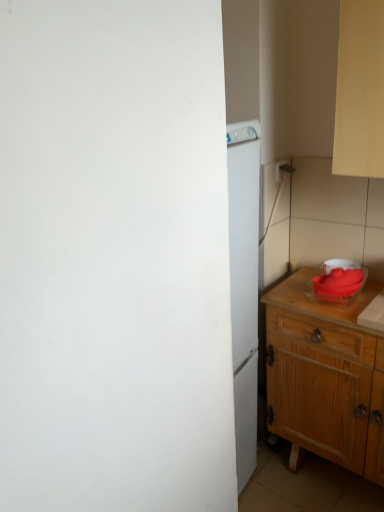
What do you see at coordinates (325, 376) in the screenshot? The width and height of the screenshot is (384, 512). I see `wooden cabinet at right` at bounding box center [325, 376].

Identify the location of matte red bowl at right. The height and width of the screenshot is (512, 384). (335, 283).

The height and width of the screenshot is (512, 384). What do you see at coordinates (335, 283) in the screenshot?
I see `matte red bowl at right` at bounding box center [335, 283].

Find the location of `white plastic electric outlet at upper right`. white plastic electric outlet at upper right is located at coordinates (281, 169).

The height and width of the screenshot is (512, 384). In order to click on wooden cabinet at right in this screenshot , I will do `click(325, 376)`.

Between point (282, 164) and point (296, 342), which one is positioned in front?

Point (296, 342)

In terms of size, does white plastic electric outlet at upper right appear bigger or smaller than wooden cabinet at right?

white plastic electric outlet at upper right is smaller than wooden cabinet at right.

Is white plastic electric outlet at upper right facing away from wooden cabinet at right?

No, white plastic electric outlet at upper right's orientation is not away from wooden cabinet at right.

Which of these two, white plastic electric outlet at upper right or wooden cabinet at right, stands shorter?

Standing shorter between the two is white plastic electric outlet at upper right.

Considering the relative sizes of matte red bowl at right and white plastic electric outlet at upper right in the image provided, is matte red bowl at right shorter than white plastic electric outlet at upper right?

No, matte red bowl at right is not shorter than white plastic electric outlet at upper right.

Can white plastic electric outlet at upper right be found inside matte red bowl at right?

Definitely not — white plastic electric outlet at upper right is not inside matte red bowl at right.

Is matte red bowl at right positioned in front of white plastic electric outlet at upper right?

Yes, it is.

How far apart are matte red bowl at right and white plastic electric outlet at upper right?

matte red bowl at right and white plastic electric outlet at upper right are 19.51 inches apart from each other.

Which is less distant, (370, 356) or (323, 270)?

Point (370, 356)

Can you see wooden cabinet at right touching matte red bowl at right?

wooden cabinet at right and matte red bowl at right are clearly separated.

From the image's perspective, between wooden cabinet at right and matte red bowl at right, who is located below?

wooden cabinet at right, from the image's perspective.

Which is more to the left, wooden cabinet at right or matte red bowl at right?

matte red bowl at right is more to the left.

From the picture: Does matte red bowl at right come in front of wooden cabinet at right?

No.

Based on the photo, is matte red bowl at right surrounding wooden cabinet at right?

No.

Which object is thinner, matte red bowl at right or wooden cabinet at right?

Thinner between the two is matte red bowl at right.

From the image's perspective, is matte red bowl at right under wooden cabinet at right?

No, from the image's perspective, matte red bowl at right is not below wooden cabinet at right.

Who is more distant, wooden cabinet at right or white plastic electric outlet at upper right?

Positioned behind is white plastic electric outlet at upper right.

Considering the relative sizes of wooden cabinet at right and white plastic electric outlet at upper right in the image provided, is wooden cabinet at right wider than white plastic electric outlet at upper right?

Correct, the width of wooden cabinet at right exceeds that of white plastic electric outlet at upper right.

Is wooden cabinet at right oriented towards white plastic electric outlet at upper right?

No, wooden cabinet at right does not turn towards white plastic electric outlet at upper right.

Looking at this image, is wooden cabinet at right inside or outside of white plastic electric outlet at upper right?

wooden cabinet at right is not inside white plastic electric outlet at upper right, it's outside.

From a real-world perspective, is white plastic electric outlet at upper right located higher than matte red bowl at right?

Yes.

Considering the relative sizes of white plastic electric outlet at upper right and matte red bowl at right in the image provided, is white plastic electric outlet at upper right bigger than matte red bowl at right?

No.

Between white plastic electric outlet at upper right and matte red bowl at right, which one has larger width?

Wider between the two is matte red bowl at right.

Considering the relative sizes of white plastic electric outlet at upper right and matte red bowl at right in the image provided, is white plastic electric outlet at upper right taller than matte red bowl at right?

In fact, white plastic electric outlet at upper right may be shorter than matte red bowl at right.

Locate an element on the screen. This screenshot has height=512, width=384. electric outlet behind the wooden cabinet at right is located at coordinates (281, 169).

Where is `electric outlet that is above the matte red bowl at right (from a real-world perspective)`? electric outlet that is above the matte red bowl at right (from a real-world perspective) is located at coordinates (281, 169).

Based on their spatial positions, is white plastic electric outlet at upper right or matte red bowl at right closer to wooden cabinet at right?

matte red bowl at right.

When comparing their distances from white plastic electric outlet at upper right, does wooden cabinet at right or matte red bowl at right seem closer?

matte red bowl at right is positioned closer to the anchor white plastic electric outlet at upper right.

Estimate the real-world distances between objects in this image. Which object is closer to wooden cabinet at right, matte red bowl at right or white plastic electric outlet at upper right?

matte red bowl at right is positioned closer to the anchor wooden cabinet at right.

Consider the image. When comparing their distances from matte red bowl at right, does white plastic electric outlet at upper right or wooden cabinet at right seem closer?

wooden cabinet at right.

From the image, which object appears to be nearer to white plastic electric outlet at upper right, matte red bowl at right or wooden cabinet at right?

Based on the image, matte red bowl at right appears to be nearer to white plastic electric outlet at upper right.

Looking at the image, which one is located further to matte red bowl at right, wooden cabinet at right or white plastic electric outlet at upper right?

white plastic electric outlet at upper right lies further to matte red bowl at right than the other object.

Identify the location of appliance between white plastic electric outlet at upper right and wooden cabinet at right in the vertical direction. Image resolution: width=384 pixels, height=512 pixels. (335, 283).